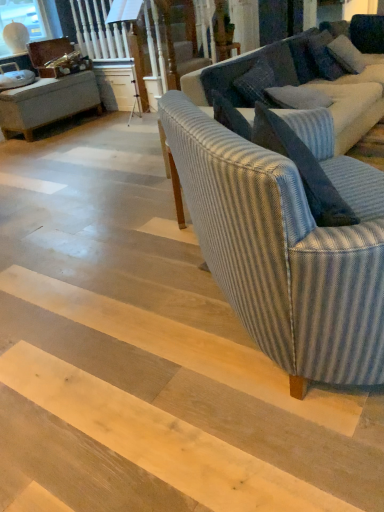
Question: Does dark gray textured pillow at upper right, which is the second pillow from bottom to top, have a larger size compared to striped fabric couch at center, arranged as the 2th studio couch when viewed from the front?

Choices:
 (A) yes
 (B) no

Answer: (B)

Question: Is dark gray textured pillow at upper right, which ranks as the first pillow in top-to-bottom order, positioned behind striped fabric couch at center, arranged as the 2th studio couch when viewed from the front?

Choices:
 (A) no
 (B) yes

Answer: (B)

Question: Could you tell me if dark gray textured pillow at upper right, positioned as the 2th pillow in front-to-back order, is facing striped fabric couch at center, arranged as the 2th studio couch when viewed from the front?

Choices:
 (A) yes
 (B) no

Answer: (A)

Question: Is striped fabric couch at center, arranged as the 2th studio couch when viewed from the front, completely or partially inside dark gray textured pillow at upper right, the 1th pillow viewed from the right?

Choices:
 (A) yes
 (B) no

Answer: (B)

Question: Considering the relative positions of dark gray textured pillow at upper right, positioned as the 2th pillow in front-to-back order, and striped fabric couch at center, arranged as the 2th studio couch when viewed from the front, in the image provided, is dark gray textured pillow at upper right, positioned as the 2th pillow in front-to-back order, in front of striped fabric couch at center, arranged as the 2th studio couch when viewed from the front,?

Choices:
 (A) yes
 (B) no

Answer: (B)

Question: Choose the correct answer: Is dark gray textured pillow at upper right, the 1th pillow viewed from the right, inside striped fabric couch at center, which ranks as the second studio couch in back-to-front order, or outside it?

Choices:
 (A) inside
 (B) outside

Answer: (B)

Question: Is point (345, 58) closer or farther from the camera than point (264, 248)?

Choices:
 (A) closer
 (B) farther

Answer: (B)

Question: Relative to striped fabric couch at center, which ranks as the second studio couch in back-to-front order, is dark gray textured pillow at upper right, the 2th pillow from the left, in front or behind?

Choices:
 (A) behind
 (B) front

Answer: (A)

Question: Is dark gray textured pillow at upper right, positioned as the 2th pillow in front-to-back order, bigger or smaller than striped fabric couch at center, arranged as the first studio couch when viewed from the front?

Choices:
 (A) small
 (B) big

Answer: (A)

Question: Do you think striped fabric couch at center, which ranks as the second studio couch in back-to-front order, is within striped fabric couch at center, placed as the 1th studio couch when sorted from back to front, or outside of it?

Choices:
 (A) inside
 (B) outside

Answer: (B)

Question: Considering the relative positions of striped fabric couch at center, arranged as the first studio couch when viewed from the front, and striped fabric couch at center, placed as the 1th studio couch when sorted from back to front, in the image provided, is striped fabric couch at center, arranged as the first studio couch when viewed from the front, to the left or to the right of striped fabric couch at center, placed as the 1th studio couch when sorted from back to front,?

Choices:
 (A) left
 (B) right

Answer: (A)

Question: From the image's perspective, relative to striped fabric couch at center, placed as the 1th studio couch when sorted from back to front, is striped fabric couch at center, which ranks as the second studio couch in back-to-front order, above or below?

Choices:
 (A) below
 (B) above

Answer: (A)

Question: Is striped fabric couch at center, which ranks as the second studio couch in back-to-front order, in front of or behind striped fabric couch at center, arranged as the 2th studio couch when viewed from the front, in the image?

Choices:
 (A) front
 (B) behind

Answer: (A)

Question: In the image, is blue striped pillow at upper right, acting as the 2th pillow starting from the back, positioned in front of or behind striped fabric couch at center, arranged as the 2th studio couch when viewed from the front?

Choices:
 (A) behind
 (B) front

Answer: (A)

Question: From a real-world perspective, is blue striped pillow at upper right, acting as the 2th pillow starting from the back, above or below striped fabric couch at center, placed as the 1th studio couch when sorted from back to front?

Choices:
 (A) above
 (B) below

Answer: (A)